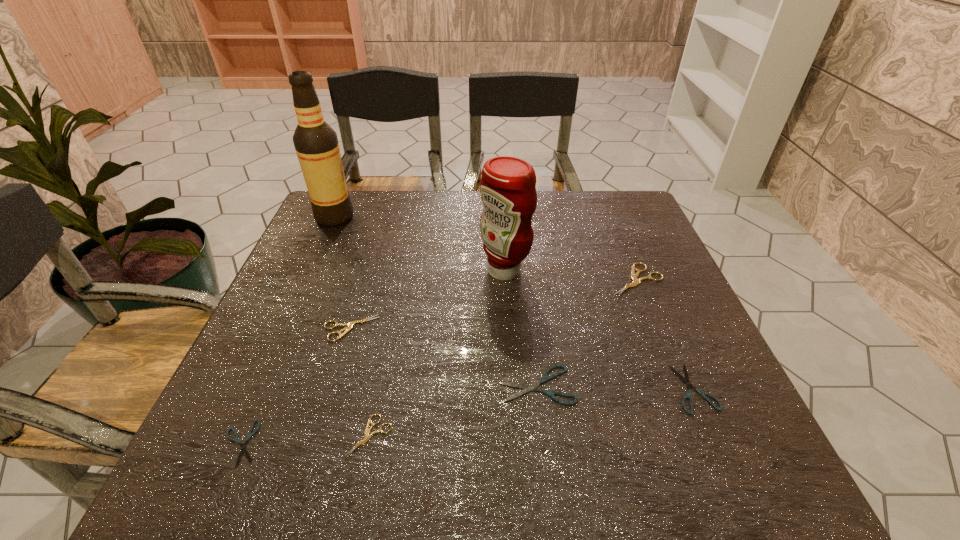
At what (x,y) coordinates should I click in order to perform the action: click on vacant space in between the second biggest black shears and the seventh shortest object. Please return your answer as a coordinate pair (x, y). This screenshot has height=540, width=960. Looking at the image, I should click on (599, 329).

Where is `object that is the fourth closest to the second black shears from left to right`? The image size is (960, 540). object that is the fourth closest to the second black shears from left to right is located at coordinates (634, 276).

Point out which object is positioned as the nearest to the condiment. Please provide its 2D coordinates. Your answer should be formatted as a tuple, i.e. [(x, y)], where the tuple contains the x and y coordinates of a point satisfying the conditions above.

[(634, 276)]

Where is `the fifth closest shears relative to the biggest black shears`? This screenshot has width=960, height=540. the fifth closest shears relative to the biggest black shears is located at coordinates (243, 446).

The image size is (960, 540). In order to click on shears that is the fourth closest to the biggest black shears in this screenshot , I will do `click(350, 325)`.

Identify which beige shears is the second closest to the biggest black shears. Please provide its 2D coordinates. Your answer should be formatted as a tuple, i.e. [(x, y)], where the tuple contains the x and y coordinates of a point satisfying the conditions above.

[(634, 276)]

Identify which beige shears is the second closest to the shortest object. Please provide its 2D coordinates. Your answer should be formatted as a tuple, i.e. [(x, y)], where the tuple contains the x and y coordinates of a point satisfying the conditions above.

[(350, 325)]

Select which black shears appears as the third closest to the farthest object. Please provide its 2D coordinates. Your answer should be formatted as a tuple, i.e. [(x, y)], where the tuple contains the x and y coordinates of a point satisfying the conditions above.

[(688, 395)]

Point out which black shears is positioned as the nearest to the tallest object. Please provide its 2D coordinates. Your answer should be formatted as a tuple, i.e. [(x, y)], where the tuple contains the x and y coordinates of a point satisfying the conditions above.

[(243, 446)]

The image size is (960, 540). I want to click on blank area in the image that satisfies the following two spatial constraints: 1. on the label of the rightmost beige shears; 2. on the right side of the farthest object, so pos(306,280).